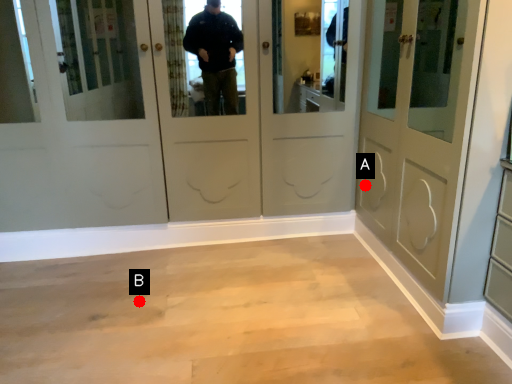
Question: Two points are circled on the image, labeled by A and B beside each circle. Which point is closer to the camera?

Choices:
 (A) A is closer
 (B) B is closer

Answer: (B)